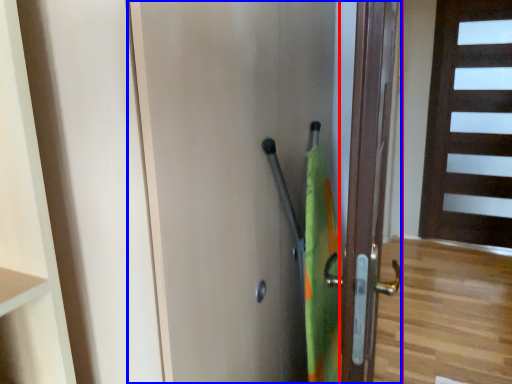
Question: Which object is further to the camera taking this photo, door (highlighted by a red box) or door (highlighted by a blue box)?

Choices:
 (A) door
 (B) door

Answer: (A)